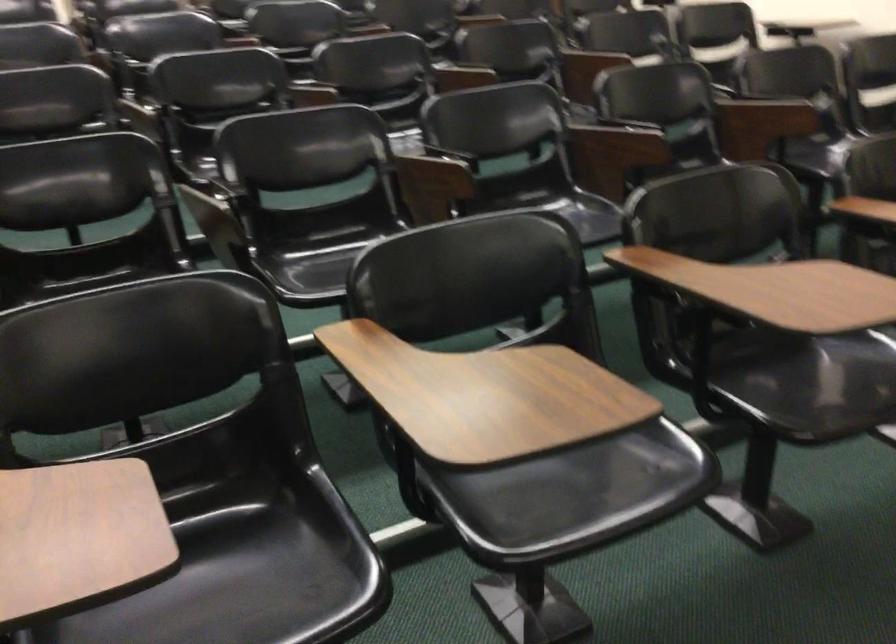
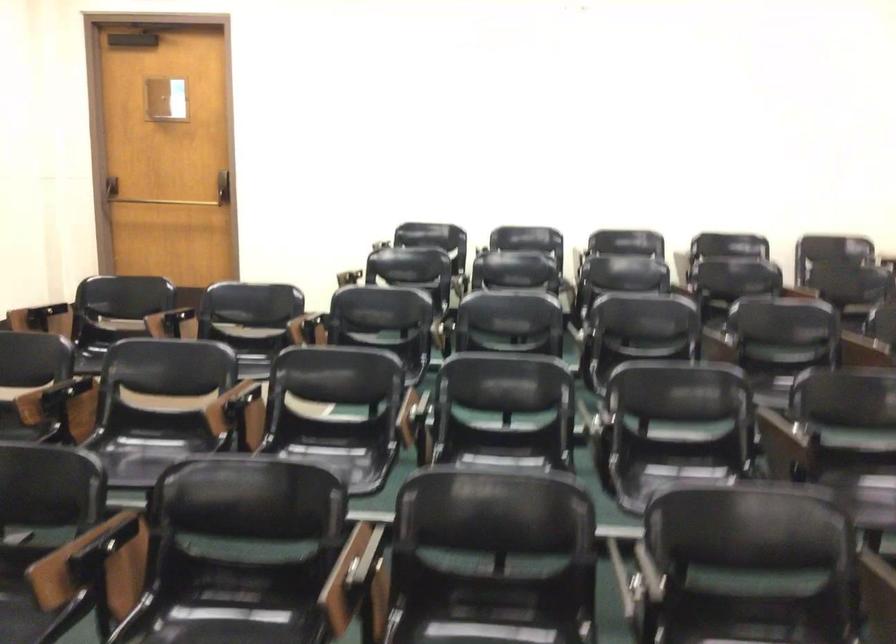
Question: Based on the continuous images, in which direction is the camera rotating? Reply with the corresponding letter.

Choices:
 (A) Left
 (B) Right
 (C) Up
 (D) Down

Answer: (A)